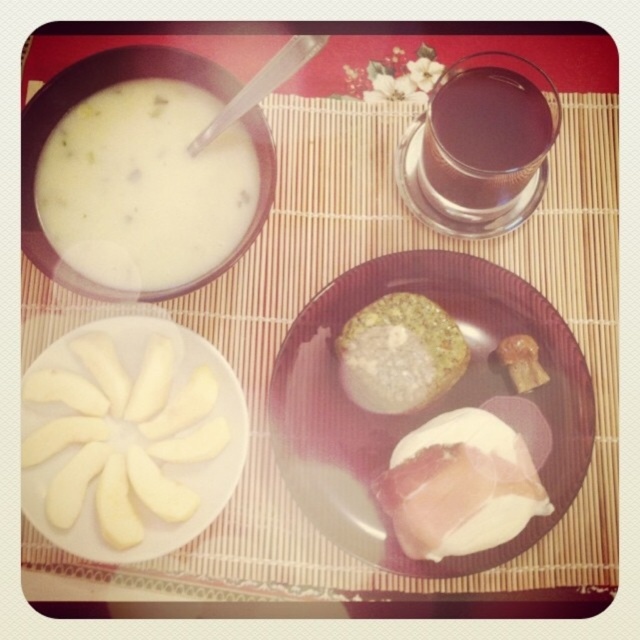
Measure the distance between white creamy soup at upper left and camera.

white creamy soup at upper left and camera are 13.30 inches apart from each other.

Between white creamy soup at upper left and white creamy cheese at center, which one appears on the left side from the viewer's perspective?

Positioned to the left is white creamy soup at upper left.

Is point (216, 188) positioned before point (401, 477)?

Yes, it is.

You are a GUI agent. You are given a task and a screenshot of the screen. Output one action in this format:
    pyautogui.click(x=<x>, y=<y>)
    Task: Click on the white creamy soup at upper left
    
    Given the screenshot: What is the action you would take?
    pyautogui.click(x=145, y=186)

Between white smooth apple slices at center left and white creamy cheese at center, which one is positioned higher?

white smooth apple slices at center left is above.

Does white smooth apple slices at center left appear on the left side of white creamy cheese at center?

Answer: Yes, white smooth apple slices at center left is to the left of white creamy cheese at center.

Who is more distant from viewer, [109,355] or [465,476]?

The point [109,355] is behind.

This screenshot has height=640, width=640. I want to click on white smooth apple slices at center left, so click(120, 436).

Is point (548, 355) positioned after point (348, 378)?

That is True.

Which is below, white glossy plate at center or slightly translucent brown cookie at center?

white glossy plate at center is below.

Measure the distance between point (371, 500) and camera.

They are 15.16 inches apart.

The image size is (640, 640). Identify the location of white glossy plate at center. (426, 406).